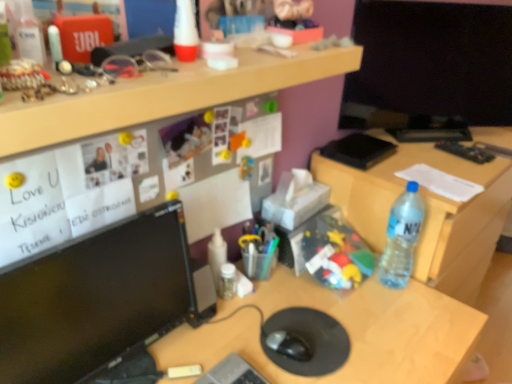
Locate an element on the screen. free region under black rubber mousepad at center (from a real-world perspective) is located at coordinates (307, 335).